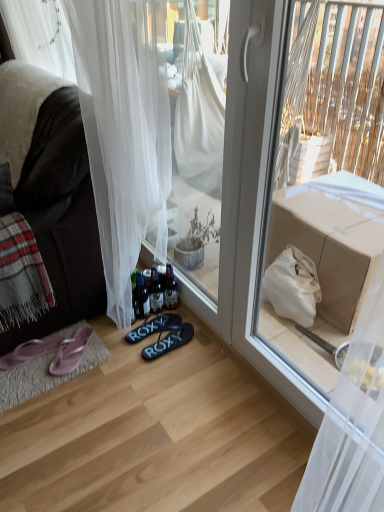
The width and height of the screenshot is (384, 512). Identify the location of white sheer curtain at lower left. (112, 120).

The image size is (384, 512). In order to click on translucent glass bottle at lower center, marked as the 2th bottle in a left-to-right arrangement in this screenshot , I will do `click(170, 289)`.

Describe the element at coordinates (141, 297) in the screenshot. I see `translucent glass bottles at lower center, which is the 1th bottle in left-to-right order` at that location.

The height and width of the screenshot is (512, 384). What are the coordinates of `pink fabric flip-flops at lower left, which is the 2th footwear in left-to-right order` in the screenshot? It's located at (70, 352).

Where is `dark brown leather couch at left`? This screenshot has width=384, height=512. dark brown leather couch at left is located at coordinates (52, 194).

Identify the location of white sheer curtain at lower left. (112, 120).

Can you tell me how much pink fabric flip-flops at lower left, arranged as the fourth footwear when viewed from the right, and pink fabric flip-flops at lower left, arranged as the third footwear when viewed from the right, differ in facing direction?

They differ by 51.8 degrees in their facing directions.

From the image's perspective, does pink fabric flip-flops at lower left, arranged as the fourth footwear when viewed from the right, appear lower than pink fabric flip-flops at lower left, arranged as the third footwear when viewed from the right?

Yes.

Between pink fabric flip-flops at lower left, the 1th footwear positioned from the left, and pink fabric flip-flops at lower left, arranged as the third footwear when viewed from the right, which one has smaller width?

Thinner between the two is pink fabric flip-flops at lower left, the 1th footwear positioned from the left.

Which of these two, pink fabric flip-flops at lower left, arranged as the fourth footwear when viewed from the right, or pink fabric flip-flops at lower left, arranged as the third footwear when viewed from the right, stands shorter?

pink fabric flip-flops at lower left, arranged as the third footwear when viewed from the right, is shorter.

Considering the relative positions of pink fabric flip-flops at lower left, which is the 2th footwear in left-to-right order, and black rubber flip-flops at center, which is the fourth footwear from left to right, in the image provided, is pink fabric flip-flops at lower left, which is the 2th footwear in left-to-right order, to the left of black rubber flip-flops at center, which is the fourth footwear from left to right, from the viewer's perspective?

Indeed, pink fabric flip-flops at lower left, which is the 2th footwear in left-to-right order, is positioned on the left side of black rubber flip-flops at center, which is the fourth footwear from left to right.

Which of these two, pink fabric flip-flops at lower left, arranged as the third footwear when viewed from the right, or black rubber flip-flops at center, the first footwear viewed from the right, is thinner?

With smaller width is black rubber flip-flops at center, the first footwear viewed from the right.

In terms of size, does pink fabric flip-flops at lower left, which is the 2th footwear in left-to-right order, appear bigger or smaller than black rubber flip-flops at center, the first footwear viewed from the right?

Considering their sizes, pink fabric flip-flops at lower left, which is the 2th footwear in left-to-right order, takes up less space than black rubber flip-flops at center, the first footwear viewed from the right.

From the image's perspective, is pink fabric flip-flops at lower left, the 1th footwear positioned from the left, beneath translucent glass bottles at lower center, which is the 1th bottle in left-to-right order?

Yes, from the image's perspective, pink fabric flip-flops at lower left, the 1th footwear positioned from the left, is below translucent glass bottles at lower center, which is the 1th bottle in left-to-right order.

Considering the relative positions of pink fabric flip-flops at lower left, the 1th footwear positioned from the left, and translucent glass bottles at lower center, which is the 1th bottle in left-to-right order, in the image provided, is pink fabric flip-flops at lower left, the 1th footwear positioned from the left, to the right of translucent glass bottles at lower center, which is the 1th bottle in left-to-right order, from the viewer's perspective?

In fact, pink fabric flip-flops at lower left, the 1th footwear positioned from the left, is to the left of translucent glass bottles at lower center, which is the 1th bottle in left-to-right order.

Is pink fabric flip-flops at lower left, the 1th footwear positioned from the left, turned away from translucent glass bottles at lower center, which is the 1th bottle in left-to-right order?

Absolutely, pink fabric flip-flops at lower left, the 1th footwear positioned from the left, is directed away from translucent glass bottles at lower center, which is the 1th bottle in left-to-right order.

Is pink fabric flip-flops at lower left, arranged as the fourth footwear when viewed from the right, spatially inside translucent glass bottles at lower center, which appears as the 2th bottle when viewed from the right, or outside of it?

pink fabric flip-flops at lower left, arranged as the fourth footwear when viewed from the right, exists outside the volume of translucent glass bottles at lower center, which appears as the 2th bottle when viewed from the right.

Looking at this image, which of these two, matte cardboard box at upper right or translucent glass bottle at lower center, marked as the 2th bottle in a left-to-right arrangement, stands shorter?

With less height is translucent glass bottle at lower center, marked as the 2th bottle in a left-to-right arrangement.

I want to click on screen door positioned vertically above the translucent glass bottle at lower center, marked as the 2th bottle in a left-to-right arrangement (from a real-world perspective), so 322,194.

Is matte cardboard box at upper right situated inside translucent glass bottle at lower center, marked as the 2th bottle in a left-to-right arrangement, or outside?

matte cardboard box at upper right lies outside translucent glass bottle at lower center, marked as the 2th bottle in a left-to-right arrangement.

Considering the relative sizes of matte cardboard box at upper right and translucent glass bottle at lower center, marked as the 1th bottle in a right-to-left arrangement, in the image provided, is matte cardboard box at upper right thinner than translucent glass bottle at lower center, marked as the 1th bottle in a right-to-left arrangement,?

No.

Is translucent glass bottle at lower center, marked as the 1th bottle in a right-to-left arrangement, in front of black rubber flip-flops at center, which is the fourth footwear from left to right?

No, it is not.

Would you consider translucent glass bottle at lower center, marked as the 2th bottle in a left-to-right arrangement, to be distant from black rubber flip-flops at center, which is the fourth footwear from left to right?

Actually, translucent glass bottle at lower center, marked as the 2th bottle in a left-to-right arrangement, and black rubber flip-flops at center, which is the fourth footwear from left to right, are a little close together.

Does point (174, 296) come behind point (166, 338)?

That is True.

At what (x,y) coordinates should I click in order to perform the action: click on footwear that is the 2nd object located below the translucent glass bottle at lower center, marked as the 2th bottle in a left-to-right arrangement (from the image's perspective). Please return your answer as a coordinate pair (x, y). This screenshot has width=384, height=512. Looking at the image, I should click on (169, 341).

Between translucent glass bottle at lower center, marked as the 2th bottle in a left-to-right arrangement, and matte cardboard box at upper right, which one has more height?

Standing taller between the two is matte cardboard box at upper right.

Considering the sizes of objects translucent glass bottle at lower center, marked as the 2th bottle in a left-to-right arrangement, and matte cardboard box at upper right in the image provided, who is thinner, translucent glass bottle at lower center, marked as the 2th bottle in a left-to-right arrangement, or matte cardboard box at upper right?

Thinner between the two is translucent glass bottle at lower center, marked as the 2th bottle in a left-to-right arrangement.

Is translucent glass bottle at lower center, marked as the 1th bottle in a right-to-left arrangement, at the right side of matte cardboard box at upper right?

No, translucent glass bottle at lower center, marked as the 1th bottle in a right-to-left arrangement, is not to the right of matte cardboard box at upper right.

Does translucent glass bottle at lower center, marked as the 2th bottle in a left-to-right arrangement, have a larger size compared to matte cardboard box at upper right?

Actually, translucent glass bottle at lower center, marked as the 2th bottle in a left-to-right arrangement, might be smaller than matte cardboard box at upper right.

Considering the points (40, 306) and (170, 298), which point is in front, point (40, 306) or point (170, 298)?

Positioned in front is point (40, 306).

Is the position of plaid woolen blanket at left more distant than that of translucent glass bottle at lower center, marked as the 1th bottle in a right-to-left arrangement?

No.

In the scene shown: Measure the distance between plaid woolen blanket at left and translucent glass bottle at lower center, marked as the 2th bottle in a left-to-right arrangement.

A distance of 24.50 inches exists between plaid woolen blanket at left and translucent glass bottle at lower center, marked as the 2th bottle in a left-to-right arrangement.

Does plaid woolen blanket at left appear on the right side of translucent glass bottle at lower center, marked as the 2th bottle in a left-to-right arrangement?

In fact, plaid woolen blanket at left is to the left of translucent glass bottle at lower center, marked as the 2th bottle in a left-to-right arrangement.

The width and height of the screenshot is (384, 512). I want to click on footwear lying in front of the pink fabric flip-flops at lower left, the 1th footwear positioned from the left, so click(70, 352).

Image resolution: width=384 pixels, height=512 pixels. I want to click on the 2nd footwear counting from the right side of the pink fabric flip-flops at lower left, which is the 2th footwear in left-to-right order, so click(169, 341).

Considering their positions, is white sheer curtain at lower left positioned closer to translucent glass bottle at lower center, marked as the 1th bottle in a right-to-left arrangement, than dark brown leather couch at left?

white sheer curtain at lower left is positioned closer to the anchor translucent glass bottle at lower center, marked as the 1th bottle in a right-to-left arrangement.

Consider the image. From the image, which object appears to be farther from plaid woolen blanket at left, pink fabric flip-flops at lower left, arranged as the third footwear when viewed from the right, or matte cardboard box at upper right?

The object further to plaid woolen blanket at left is matte cardboard box at upper right.

In the scene shown: Based on their spatial positions, is pink fabric flip-flops at lower left, the 1th footwear positioned from the left, or matte cardboard box at upper right further from pink fabric flip-flops at lower left, which is the 2th footwear in left-to-right order?

Among the two, matte cardboard box at upper right is located further to pink fabric flip-flops at lower left, which is the 2th footwear in left-to-right order.

In the scene shown: Estimate the real-world distances between objects in this image. Which object is closer to pink fabric flip-flops at lower left, which is the 2th footwear in left-to-right order, matte cardboard box at upper right or white sheer curtain at lower left?

Based on the image, white sheer curtain at lower left appears to be nearer to pink fabric flip-flops at lower left, which is the 2th footwear in left-to-right order.

Based on their spatial positions, is black rubber flip-flops at center, the first footwear viewed from the right, or matte cardboard box at upper right further from pink fabric flip-flops at lower left, arranged as the third footwear when viewed from the right?

The object further to pink fabric flip-flops at lower left, arranged as the third footwear when viewed from the right, is matte cardboard box at upper right.

Looking at the image, which one is located further to translucent glass bottles at lower center, which is the 1th bottle in left-to-right order, pink fabric flip-flops at lower left, which is the 2th footwear in left-to-right order, or pink fabric flip-flops at lower left, the 1th footwear positioned from the left?

pink fabric flip-flops at lower left, the 1th footwear positioned from the left, lies further to translucent glass bottles at lower center, which is the 1th bottle in left-to-right order, than the other object.

Looking at the image, which one is located closer to white sheer curtain at lower left, matte cardboard box at upper right or pink fabric flip-flops at lower left, which is the 2th footwear in left-to-right order?

pink fabric flip-flops at lower left, which is the 2th footwear in left-to-right order, is positioned closer to the anchor white sheer curtain at lower left.

From the image, which object appears to be nearer to pink fabric flip-flops at lower left, the 1th footwear positioned from the left, translucent glass bottles at lower center, which appears as the 2th bottle when viewed from the right, or pink fabric flip-flops at lower left, arranged as the third footwear when viewed from the right?

pink fabric flip-flops at lower left, arranged as the third footwear when viewed from the right.

Identify the location of bottle between white sheer curtain at lower left and translucent glass bottle at lower center, marked as the 1th bottle in a right-to-left arrangement, along the z-axis. (x=141, y=297).

Locate an element on the screen. bottle between plaid woolen blanket at left and black rubber flip-flops at center, which is the fourth footwear from left to right is located at coordinates (141, 297).

Where is `curtain located between plaid woolen blanket at left and matte cardboard box at upper right in the left-right direction`? curtain located between plaid woolen blanket at left and matte cardboard box at upper right in the left-right direction is located at coordinates (112, 120).

This screenshot has width=384, height=512. I want to click on blanket between dark brown leather couch at left and pink fabric flip-flops at lower left, arranged as the fourth footwear when viewed from the right, in the up-down direction, so click(21, 275).